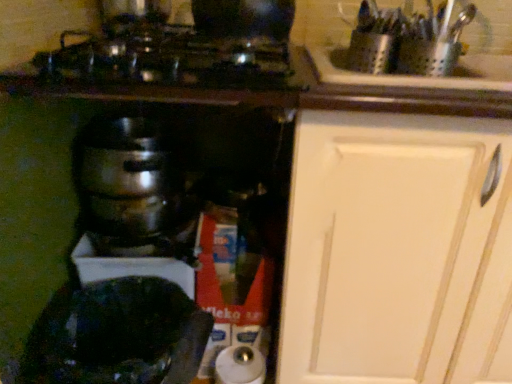
Find the location of a particular element. white matte cabinet at upper right is located at coordinates (398, 251).

What is the approximate height of shiny metallic pot at center?

shiny metallic pot at center is 5.69 inches tall.

What do you see at coordinates (134, 191) in the screenshot?
I see `shiny metallic pot at center` at bounding box center [134, 191].

Find the location of a particular element. shiny black pot at lower left is located at coordinates (118, 335).

Measure the distance between shiny black pot at lower left and white matte cabinet at upper right.

shiny black pot at lower left and white matte cabinet at upper right are 16.69 inches apart.

From a real-world perspective, between shiny black pot at lower left and white matte cabinet at upper right, who is vertically lower?

shiny black pot at lower left is physically lower.

Which of these two, shiny black pot at lower left or white matte cabinet at upper right, stands taller?

With more height is white matte cabinet at upper right.

From the picture: Is shiny black pot at lower left positioned behind white matte cabinet at upper right?

Yes, it is.

From the image's perspective, does shiny metallic pot at center appear lower than white matte cabinet at upper right?

Actually, shiny metallic pot at center appears above white matte cabinet at upper right in the image.

From a real-world perspective, between shiny metallic pot at center and white matte cabinet at upper right, who is vertically lower?

In real-world perspective, white matte cabinet at upper right is lower.

Locate an element on the screen. The height and width of the screenshot is (384, 512). kitchen appliance behind the white matte cabinet at upper right is located at coordinates click(x=134, y=191).

Which is in front, point (93, 184) or point (316, 379)?

The point (316, 379) is more forward.

Does white matte cabinet at upper right contain shiny black pot at lower left?

No, white matte cabinet at upper right does not contain shiny black pot at lower left.

How far apart are white matte cabinet at upper right and shiny black pot at lower left?

A distance of 16.69 inches exists between white matte cabinet at upper right and shiny black pot at lower left.

From the image's perspective, between white matte cabinet at upper right and shiny black pot at lower left, which one is located above?

white matte cabinet at upper right.

Is white matte cabinet at upper right closer to camera compared to shiny black pot at lower left?

Yes, white matte cabinet at upper right is in front of shiny black pot at lower left.

Which object is thinner, shiny metallic pot at center or shiny metallic cookware at upper center?

Thinner between the two is shiny metallic pot at center.

From the image's perspective, is shiny metallic pot at center positioned above or below shiny metallic cookware at upper center?

shiny metallic pot at center is situated lower than shiny metallic cookware at upper center in the image.

Is shiny metallic pot at center spatially inside shiny metallic cookware at upper center, or outside of it?

The correct answer is: outside.

From a real-world perspective, is white matte cabinet at upper right above or below shiny metallic pot at center?

white matte cabinet at upper right is situated lower than shiny metallic pot at center in the real world.

Is white matte cabinet at upper right next to shiny metallic pot at center and touching it?

No, white matte cabinet at upper right is not in contact with shiny metallic pot at center.

From the image's perspective, would you say white matte cabinet at upper right is shown under shiny metallic pot at center?

Indeed, from the image's perspective, white matte cabinet at upper right is shown beneath shiny metallic pot at center.

Is white matte cabinet at upper right facing towards shiny metallic pot at center?

No, white matte cabinet at upper right does not turn towards shiny metallic pot at center.

Which is more to the left, shiny black pot at lower left or shiny metallic cookware at upper center?

From the viewer's perspective, shiny black pot at lower left appears more on the left side.

Is shiny black pot at lower left taller than shiny metallic cookware at upper center?

Indeed, shiny black pot at lower left has a greater height compared to shiny metallic cookware at upper center.

Between point (31, 353) and point (104, 32), which one is positioned in front?

The point (31, 353) is closer to the camera.

Measure the distance from shiny black pot at lower left to shiny metallic cookware at upper center.

shiny black pot at lower left and shiny metallic cookware at upper center are 56.09 centimeters apart from each other.

Is shiny metallic cookware at upper center at the right side of shiny black pot at lower left?

Yes, shiny metallic cookware at upper center is to the right of shiny black pot at lower left.

Can you confirm if shiny metallic cookware at upper center is wider than shiny black pot at lower left?

Indeed, shiny metallic cookware at upper center has a greater width compared to shiny black pot at lower left.

In the scene shown: Is shiny metallic cookware at upper center facing away from shiny black pot at lower left?

That's not correct — shiny metallic cookware at upper center is not looking away from shiny black pot at lower left.

I want to click on cabinetry lying on the right of shiny black pot at lower left, so click(x=398, y=251).

Where is `kitchen appliance lying on the left of white matte cabinet at upper right`? The image size is (512, 384). kitchen appliance lying on the left of white matte cabinet at upper right is located at coordinates (134, 191).

Based on their spatial positions, is white matte cabinet at upper right or shiny black pot at lower left closer to shiny metallic pot at center?

Among the two, shiny black pot at lower left is located nearer to shiny metallic pot at center.

Estimate the real-world distances between objects in this image. Which object is further from shiny black pot at lower left, shiny metallic cookware at upper center or white matte cabinet at upper right?

shiny metallic cookware at upper center is positioned further to the anchor shiny black pot at lower left.

Considering their positions, is white matte cabinet at upper right positioned closer to shiny black pot at lower left than shiny metallic cookware at upper center?

The object closer to shiny black pot at lower left is white matte cabinet at upper right.

Looking at the image, which one is located further to shiny metallic pot at center, shiny metallic cookware at upper center or shiny black pot at lower left?

shiny metallic cookware at upper center is further to shiny metallic pot at center.

When comparing their distances from shiny black pot at lower left, does shiny metallic pot at center or white matte cabinet at upper right seem further?

Among the two, white matte cabinet at upper right is located further to shiny black pot at lower left.

Which object lies further to the anchor point white matte cabinet at upper right, shiny black pot at lower left or shiny metallic cookware at upper center?

shiny black pot at lower left.

Considering their positions, is shiny metallic pot at center positioned further to shiny black pot at lower left than shiny metallic cookware at upper center?

The object further to shiny black pot at lower left is shiny metallic cookware at upper center.

Estimate the real-world distances between objects in this image. Which object is further from shiny metallic pot at center, shiny black pot at lower left or white matte cabinet at upper right?

white matte cabinet at upper right is positioned further to the anchor shiny metallic pot at center.

Image resolution: width=512 pixels, height=384 pixels. Find the location of `gas stove between shiny black pot at lower left and white matte cabinet at upper right from left to right`. gas stove between shiny black pot at lower left and white matte cabinet at upper right from left to right is located at coordinates (168, 58).

Find the location of `gas stove between shiny metallic pot at center and white matte cabinet at upper right from left to right`. gas stove between shiny metallic pot at center and white matte cabinet at upper right from left to right is located at coordinates (168, 58).

Find the location of `kitchen appliance that lies between shiny metallic cookware at upper center and shiny black pot at lower left from top to bottom`. kitchen appliance that lies between shiny metallic cookware at upper center and shiny black pot at lower left from top to bottom is located at coordinates (134, 191).

Where is `appliance between shiny metallic pot at center and white matte cabinet at upper right`? This screenshot has width=512, height=384. appliance between shiny metallic pot at center and white matte cabinet at upper right is located at coordinates (118, 335).